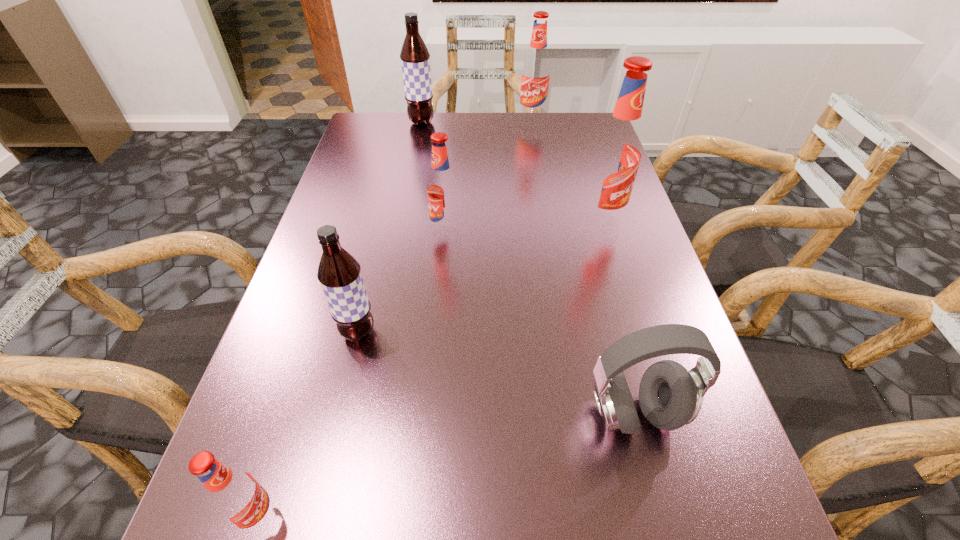
Find the location of `the rightmost red root beer`. the rightmost red root beer is located at coordinates (616, 154).

Where is `the biggest red root beer`? The image size is (960, 540). the biggest red root beer is located at coordinates (616, 154).

The image size is (960, 540). Identify the location of the fifth root beer from left to right. (535, 79).

Find the location of `the second red root beer from right to left`. the second red root beer from right to left is located at coordinates (535, 79).

I want to click on the farther brown root beer, so click(x=415, y=58).

Find the location of a particular element. The image size is (960, 540). the third biggest red root beer is located at coordinates (442, 188).

At what (x,y) coordinates should I click in order to perform the action: click on the third root beer from right to left. Please return your answer as a coordinate pair (x, y). The width and height of the screenshot is (960, 540). Looking at the image, I should click on (442, 188).

Image resolution: width=960 pixels, height=540 pixels. I want to click on the second nearest root beer, so click(x=339, y=273).

The height and width of the screenshot is (540, 960). Identify the location of the smaller brown root beer. (339, 273).

You are a GUI agent. You are given a task and a screenshot of the screen. Output one action in this format:
    pyautogui.click(x=<x>, y=<y>)
    Task: Click on the second nearest object
    The height and width of the screenshot is (540, 960).
    Given the screenshot: What is the action you would take?
    click(670, 396)